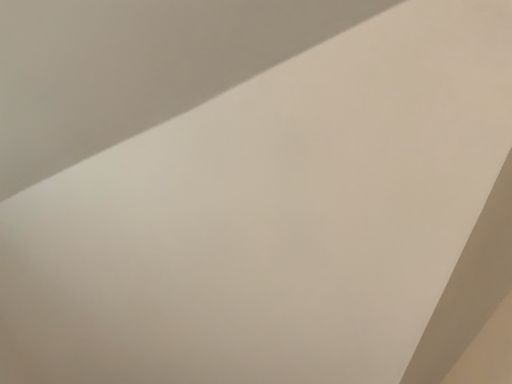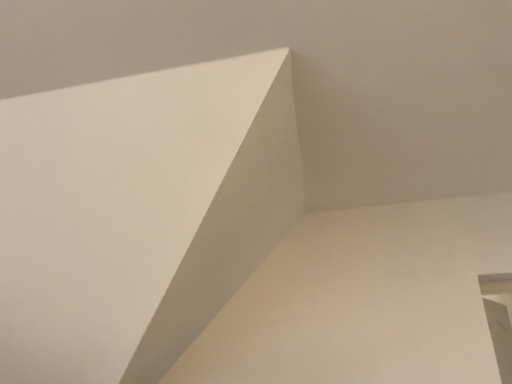
Question: How did the camera likely rotate when shooting the video?

Choices:
 (A) rotated left
 (B) rotated right

Answer: (B)